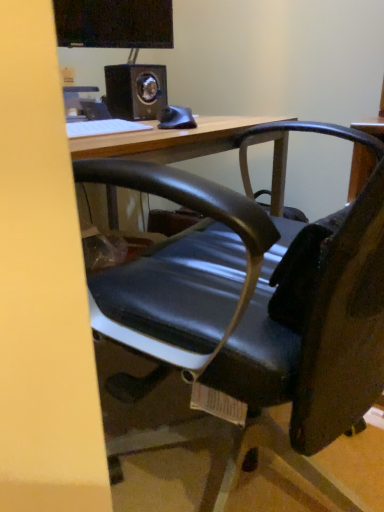
Question: Is metallic black speaker at upper center shorter than white matte keyboard at upper left?

Choices:
 (A) no
 (B) yes

Answer: (A)

Question: Is metallic black speaker at upper center closer to the viewer compared to white matte keyboard at upper left?

Choices:
 (A) no
 (B) yes

Answer: (A)

Question: Does metallic black speaker at upper center come behind white matte keyboard at upper left?

Choices:
 (A) yes
 (B) no

Answer: (A)

Question: Does metallic black speaker at upper center appear on the right side of white matte keyboard at upper left?

Choices:
 (A) no
 (B) yes

Answer: (B)

Question: Could you tell me if metallic black speaker at upper center is turned towards white matte keyboard at upper left?

Choices:
 (A) no
 (B) yes

Answer: (A)

Question: Considering the positions of point click(137, 108) and point click(218, 361), is point click(137, 108) closer or farther from the camera than point click(218, 361)?

Choices:
 (A) farther
 (B) closer

Answer: (A)

Question: In the image, is metallic black speaker at upper center positioned in front of or behind wooden desk at center?

Choices:
 (A) behind
 (B) front

Answer: (A)

Question: In the image, is metallic black speaker at upper center on the left side or the right side of wooden desk at center?

Choices:
 (A) right
 (B) left

Answer: (B)

Question: From a real-world perspective, is metallic black speaker at upper center positioned above or below wooden desk at center?

Choices:
 (A) above
 (B) below

Answer: (A)

Question: In the image, is metallic black speaker at upper center positioned in front of or behind black glossy monitor at upper center?

Choices:
 (A) front
 (B) behind

Answer: (A)

Question: From the image's perspective, relative to black glossy monitor at upper center, is metallic black speaker at upper center above or below?

Choices:
 (A) below
 (B) above

Answer: (A)

Question: Would you say metallic black speaker at upper center is to the left or to the right of black glossy monitor at upper center in the picture?

Choices:
 (A) left
 (B) right

Answer: (B)

Question: From a real-world perspective, relative to black glossy monitor at upper center, is metallic black speaker at upper center vertically above or below?

Choices:
 (A) above
 (B) below

Answer: (B)

Question: Considering the positions of wooden desk at center and black glossy monitor at upper center in the image, is wooden desk at center bigger or smaller than black glossy monitor at upper center?

Choices:
 (A) big
 (B) small

Answer: (A)

Question: From the image's perspective, is wooden desk at center above or below black glossy monitor at upper center?

Choices:
 (A) below
 (B) above

Answer: (A)